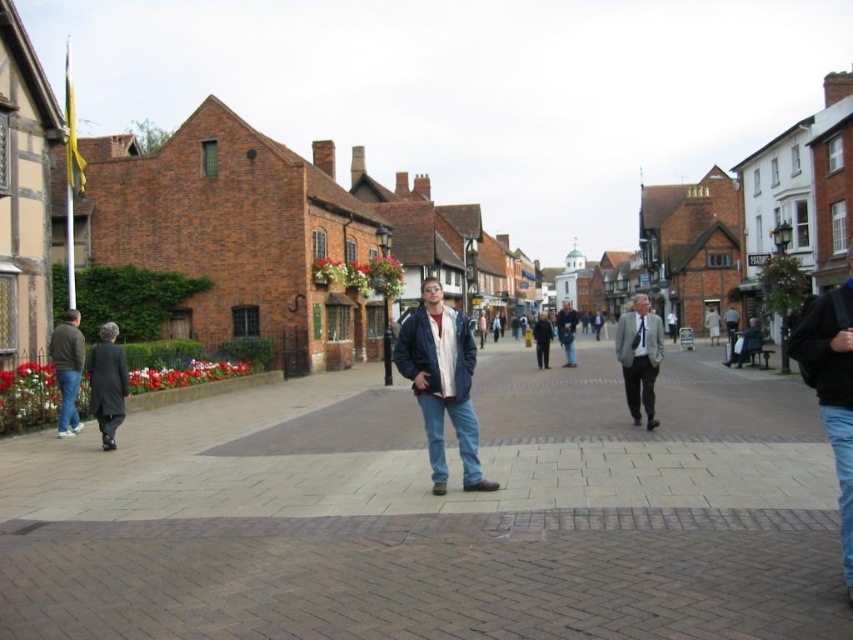
Question: Which object is closer to the camera taking this photo?

Choices:
 (A) black leather jacket at lower right
 (B) dark blue jacket at center
 (C) gray suit at center
 (D) brown brick pavement at center

Answer: (D)

Question: Considering the relative positions of dark gray wool coat at left and dark blue jacket at center in the image provided, where is dark gray wool coat at left located with respect to dark blue jacket at center?

Choices:
 (A) left
 (B) right

Answer: (A)

Question: Estimate the real-world distances between objects in this image. Which object is closer to the brown brick pavement at center?

Choices:
 (A) black leather jacket at lower right
 (B) dark gray wool coat at left

Answer: (A)

Question: Is denim jacket at center in front of gray suit at center?

Choices:
 (A) yes
 (B) no

Answer: (A)

Question: Which object is the farthest from the black leather jacket at lower right?

Choices:
 (A) dark gray wool coat at left
 (B) brown brick pavement at center

Answer: (A)

Question: Is black leather jacket at lower right smaller than dark gray wool coat at left?

Choices:
 (A) no
 (B) yes

Answer: (A)